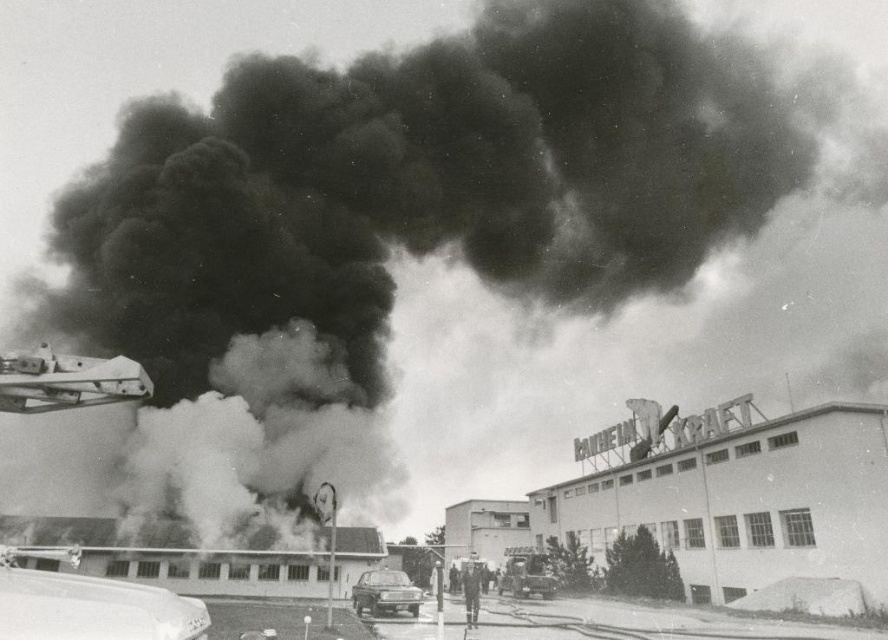
Is shiny silver car at lower left shorter than silver metallic car at center?

In fact, shiny silver car at lower left may be taller than silver metallic car at center.

Is shiny silver car at lower left positioned at the back of silver metallic car at center?

That is False.

Image resolution: width=888 pixels, height=640 pixels. Describe the element at coordinates (89, 604) in the screenshot. I see `shiny silver car at lower left` at that location.

Locate an element on the screen. This screenshot has width=888, height=640. shiny silver car at lower left is located at coordinates (89, 604).

Is silver metallic car at center further to camera compared to metallic silver car at center?

No.

Can you confirm if silver metallic car at center is wider than metallic silver car at center?

Yes, silver metallic car at center is wider than metallic silver car at center.

Does point (401, 588) lie in front of point (503, 570)?

Yes, it is in front of point (503, 570).

Find the location of `silver metallic car at center`. silver metallic car at center is located at coordinates (385, 593).

Is shiny silver car at lower left further to camera compared to metallic silver car at center?

No, it is not.

Who is more forward, (53,636) or (537,564)?

Point (53,636) is more forward.

Which is in front, point (70, 573) or point (514, 589)?

Point (70, 573) is in front.

Find the location of `shiny silver car at lower left`. shiny silver car at lower left is located at coordinates (89, 604).